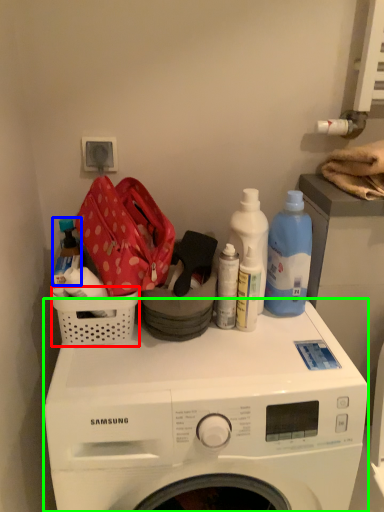
Question: Which object is the farthest from basket (highlighted by a red box)? Choose among these: bottle (highlighted by a blue box) or washing machine (highlighted by a green box).

Choices:
 (A) bottle
 (B) washing machine

Answer: (B)